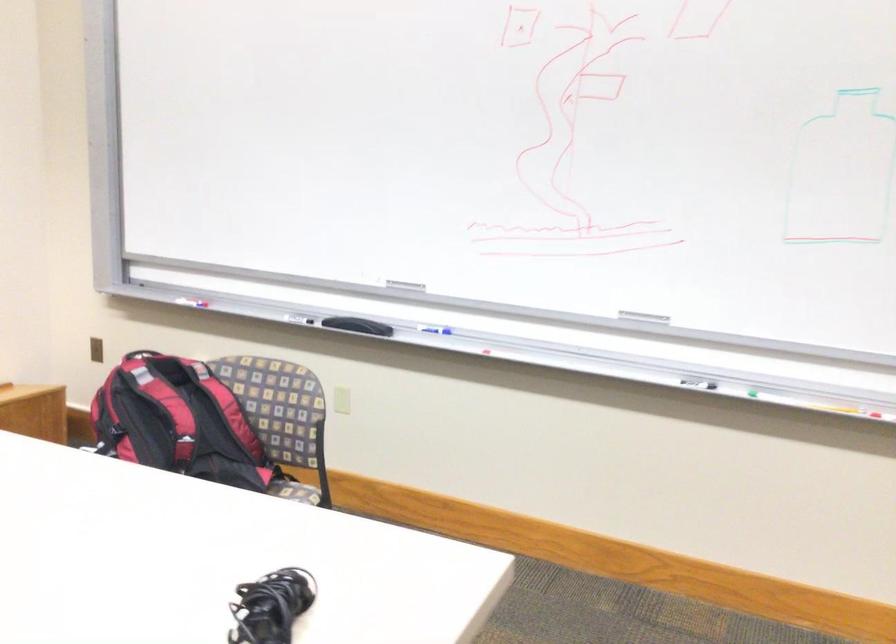
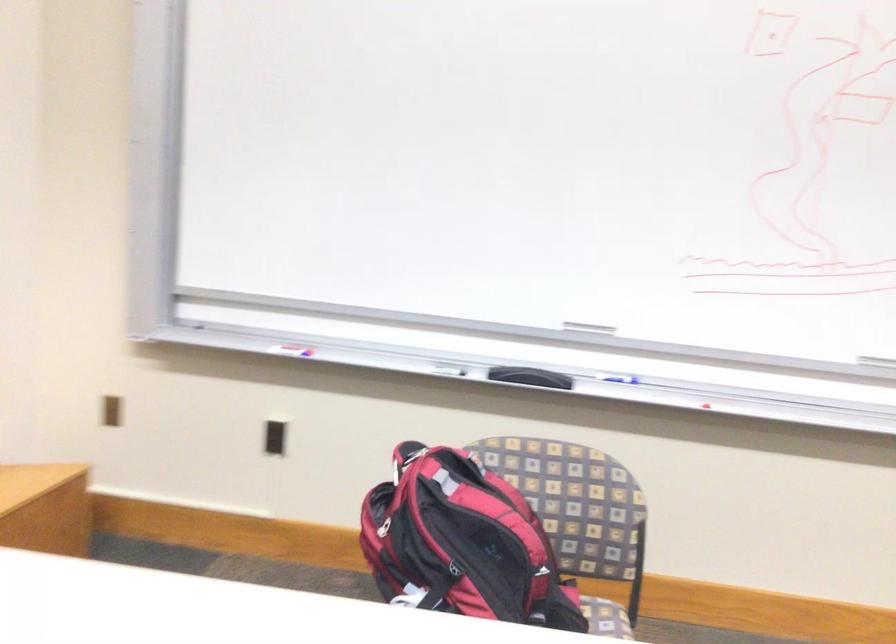
Find the pixel in the second image that matches pixel 311 502 in the first image.

(606, 618)